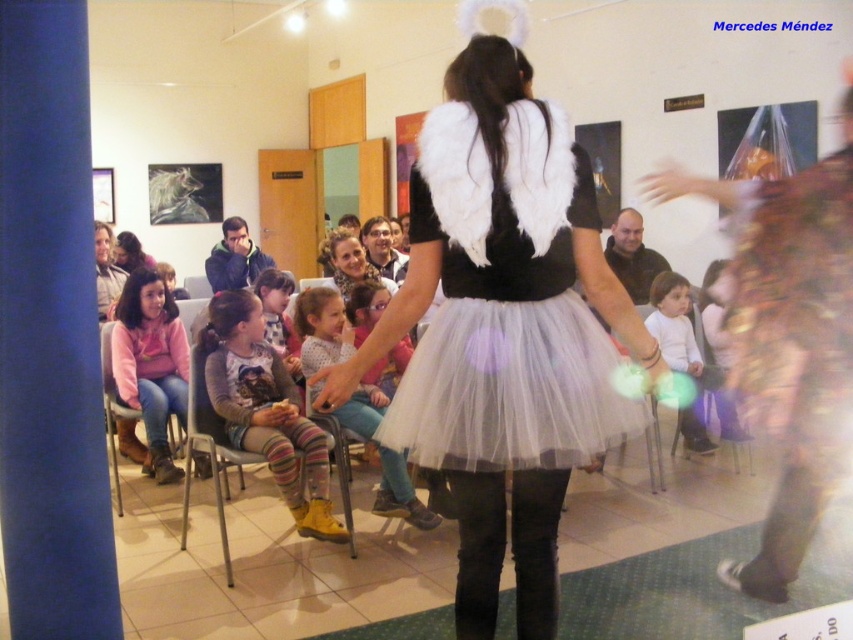
Question: Which object is closer to the camera taking this photo?

Choices:
 (A) white fluffy tutu at center
 (B) matte pink sweater at upper left
 (C) white tulle skirt at center
 (D) yellow fabric pants at center

Answer: (C)

Question: Does white fluffy wings at center have a larger size compared to gold sequined dress at center?

Choices:
 (A) no
 (B) yes

Answer: (A)

Question: Is striped wool leggings at center bigger than white fluffy tutu at center?

Choices:
 (A) yes
 (B) no

Answer: (A)

Question: Can you confirm if gold sequined dress at center is positioned to the left of yellow fabric pants at center?

Choices:
 (A) no
 (B) yes

Answer: (A)

Question: Which object appears farthest from the camera in this image?

Choices:
 (A) pink fleece jacket at center
 (B) striped wool leggings at center

Answer: (A)

Question: Which of the following is the closest to the observer?

Choices:
 (A) (105, 314)
 (B) (364, 252)
 (C) (167, 365)

Answer: (C)